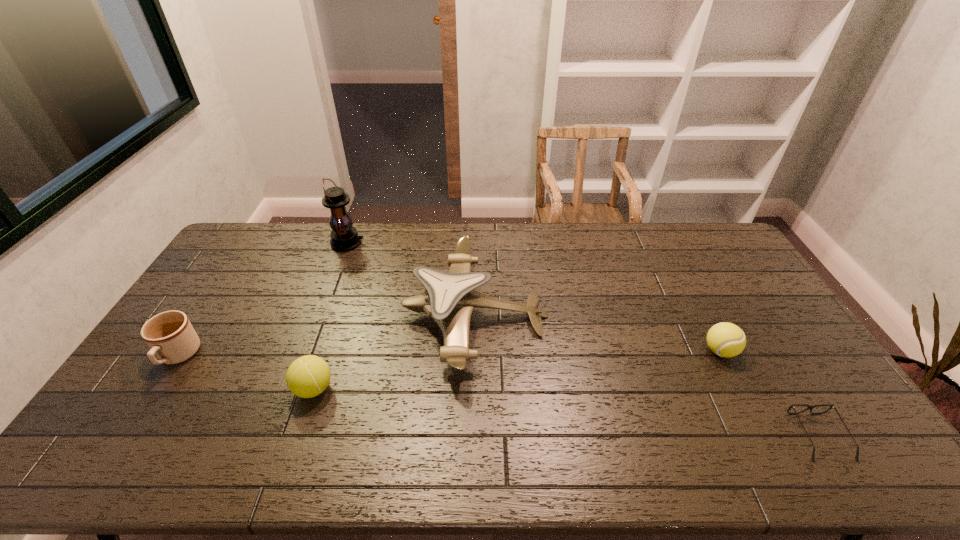
This screenshot has height=540, width=960. I want to click on free point located on the front-facing side of the fourth object from left to right, so click(x=654, y=315).

This screenshot has height=540, width=960. In order to click on free space located on the side of the mug with the handle in this screenshot , I will do `click(141, 413)`.

At what (x,y) coordinates should I click in order to perform the action: click on free space located 0.050m on the front of the nearer tennis ball. Please return your answer as a coordinate pair (x, y). Image resolution: width=960 pixels, height=540 pixels. Looking at the image, I should click on (301, 424).

The width and height of the screenshot is (960, 540). In order to click on blank area located on the back of the farther tennis ball in this screenshot , I will do 670,256.

Locate an element on the screen. Image resolution: width=960 pixels, height=540 pixels. lantern that is at the far edge is located at coordinates (344, 237).

Find the location of `drone that is at the far edge`. drone that is at the far edge is located at coordinates (449, 299).

Identify the location of object at the near edge. The width and height of the screenshot is (960, 540). (831, 405).

Where is `object present at the left edge`? object present at the left edge is located at coordinates (170, 336).

Identify the location of object that is at the right edge. The width and height of the screenshot is (960, 540). (831, 405).

You are a GUI agent. You are given a task and a screenshot of the screen. Output one action in this format:
    pyautogui.click(x=<x>, y=<y>)
    Task: Click on the object that is at the near right corner
    
    Given the screenshot: What is the action you would take?
    pyautogui.click(x=831, y=405)